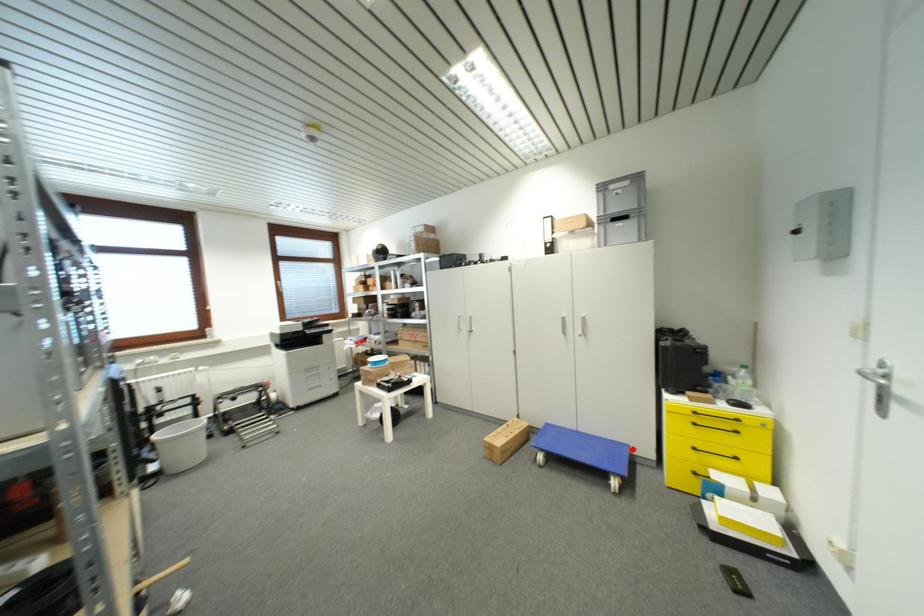
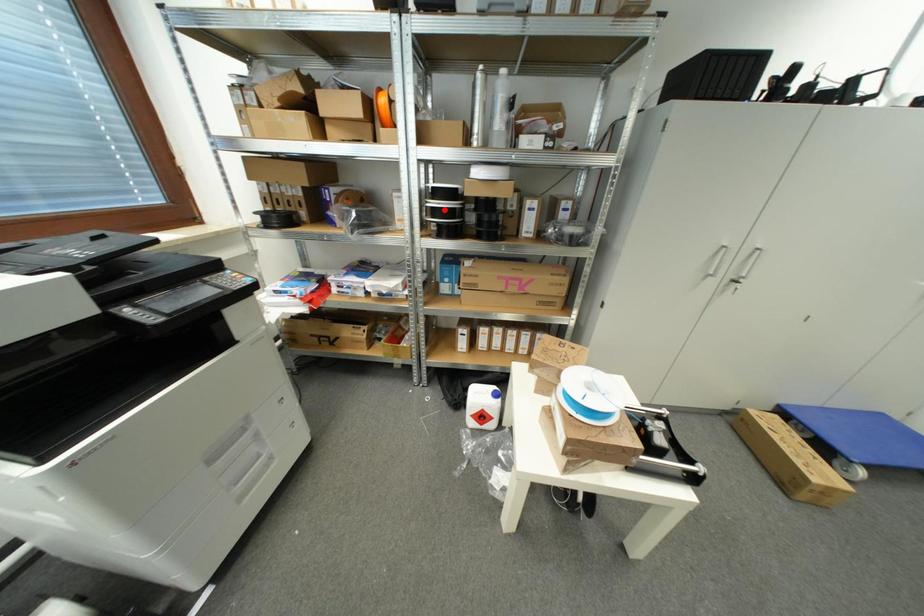
I am providing you with two images of the same scene from different viewpoints. A red point is marked on the first image and another point is marked on the second image. Is the red point in image1 aligned with the point shown in image2?

No